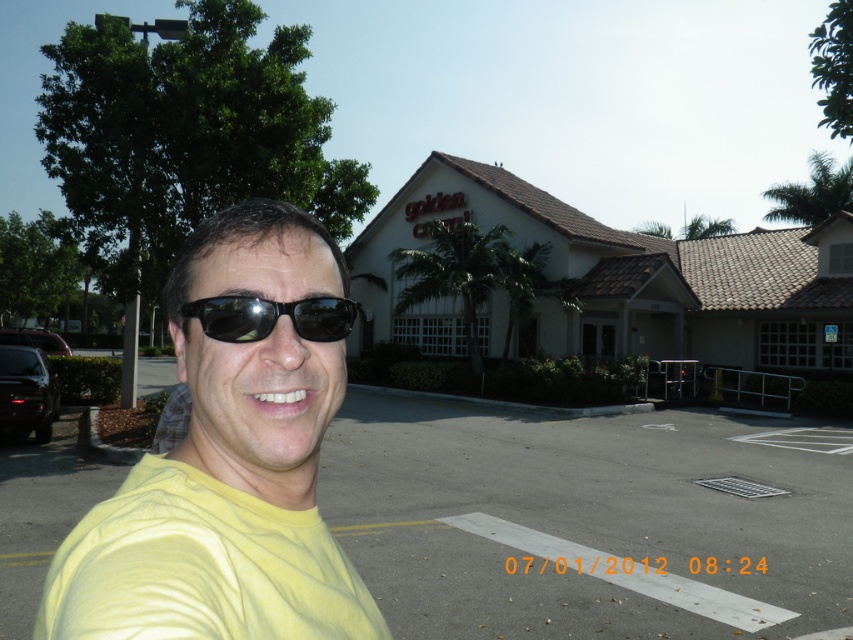
You are a photographer adjusting the camera focus. The subject is wearing a yellow matte shirt at center and black matte sunglasses at center. If the focus range can only cover 7 inches, will both items be in focus?

The yellow matte shirt at center and black matte sunglasses at center are 7.56 inches apart from each other. Since the focus range is only 7 inches, they will not both be in focus.

You are standing at the point closest to the entrance ramp of the golden corral building. There are two points marked in the image, one at coordinates point (453, 616) and the other at point (229, 317). Which point is farther away from your current position?

Point (453, 616) is behind point (229, 317), so it is farther away from your current position at the entrance ramp.

You are a photographer trying to capture the entire scene of the man in his yellow matte shirt at center and the gray asphalt parking lot at center. Since the parking lot is larger, which object would require you to zoom out more to include it fully in the photo?

The gray asphalt parking lot at center is larger in size than the yellow matte shirt at center, so you would need to zoom out more to include the gray asphalt parking lot at center in the photo.